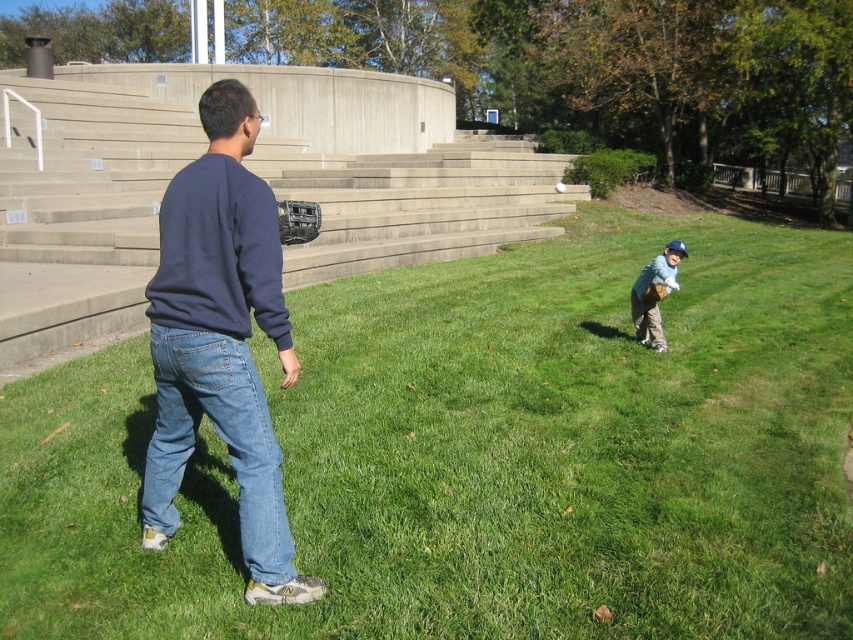
Question: Which point is farther to the camera?

Choices:
 (A) green grass at center
 (B) denim jeans at lower left

Answer: (B)

Question: Is denim jeans at lower left wider than light blue jersey at lower right?

Choices:
 (A) no
 (B) yes

Answer: (B)

Question: Is dark blue sweatshirt at center above light blue jersey at lower right?

Choices:
 (A) yes
 (B) no

Answer: (B)

Question: Can you confirm if denim jeans at lower left is positioned below light blue jersey at lower right?

Choices:
 (A) no
 (B) yes

Answer: (B)

Question: Which object appears farthest from the camera in this image?

Choices:
 (A) green grass at center
 (B) denim jeans at lower left

Answer: (B)

Question: Which point is farther to the camera?

Choices:
 (A) denim jeans at lower left
 (B) dark blue sweatshirt at center

Answer: (A)